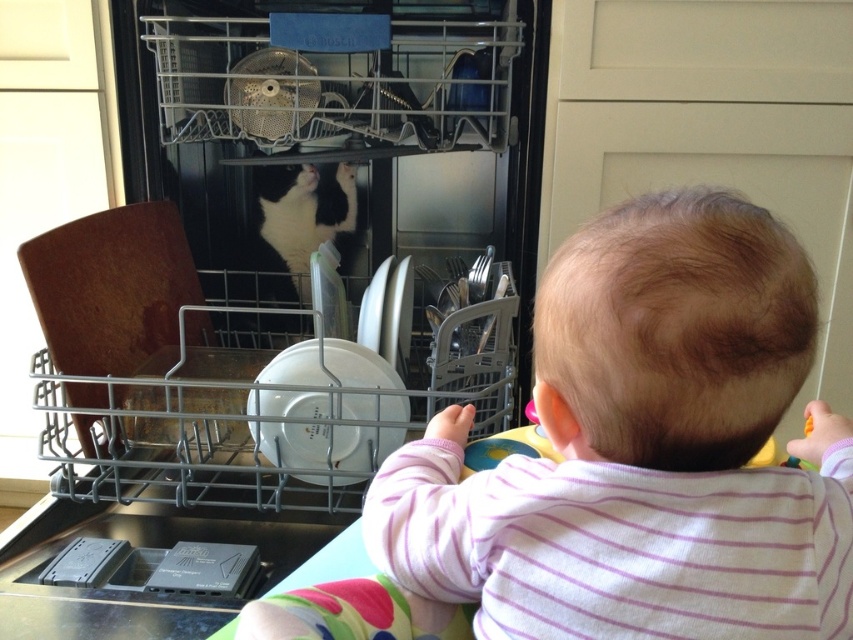
You are a parent trying to ensure your baby stays safe while playing near the matte black dishwasher at center and the smooth pink shirt at center. Which object is closer to the baby, requiring immediate attention?

The matte black dishwasher at center is closer to the baby than the smooth pink shirt at center, so immediate attention should be given to the dishwasher to ensure safety.

You are a parent trying to decide whether to let your baby interact with the black and white fur at center and the smooth pink shirt at center. Considering their sizes, which one is bigger?

The smooth pink shirt at center is larger in size than the black and white fur at center, so the smooth pink shirt at center is bigger.

You are a parent trying to ensure the baby is safe. The baby is near the matte black dishwasher at center and the smooth pink shirt at center. Which object is larger and could potentially pose a greater risk if the baby tries to climb onto it?

The matte black dishwasher at center is bigger than the smooth pink shirt at center, so it is larger and could pose a greater risk if the baby tries to climb onto it.